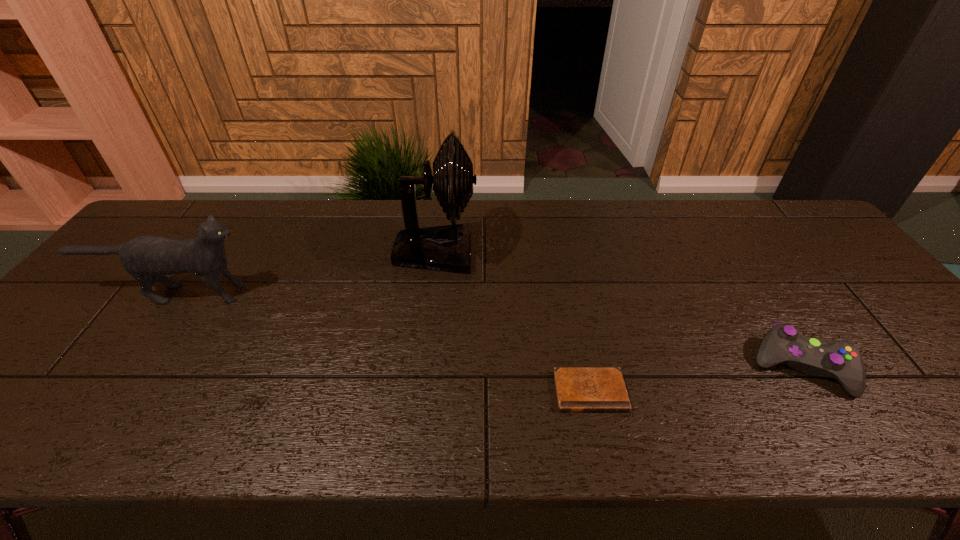
You are a GUI agent. You are given a task and a screenshot of the screen. Output one action in this format:
    pyautogui.click(x=<x>, y=<y>)
    Task: Click on the free space between the shortest object and the fan
    
    Given the screenshot: What is the action you would take?
    pyautogui.click(x=513, y=322)

You are a GUI agent. You are given a task and a screenshot of the screen. Output one action in this format:
    pyautogui.click(x=<x>, y=<y>)
    Task: Click on the unoccupied area between the rightmost object and the third shortest object
    The height and width of the screenshot is (540, 960).
    Given the screenshot: What is the action you would take?
    pyautogui.click(x=488, y=330)

Locate an element on the screen. Image resolution: width=960 pixels, height=540 pixels. free point between the rightmost object and the second farthest object is located at coordinates (488, 330).

In order to click on unoccupied area between the second shortest object and the diary in this screenshot , I will do pos(696,380).

The image size is (960, 540). Find the location of `free space between the farthest object and the second object from right to left`. free space between the farthest object and the second object from right to left is located at coordinates (513, 322).

The image size is (960, 540). In order to click on free space between the fan and the third nearest object in this screenshot , I will do `click(305, 273)`.

What are the coordinates of `unoccupied position between the leftmost object and the tallest object` in the screenshot? It's located at (305, 273).

Find the location of a particular element. This screenshot has width=960, height=540. empty space between the leftmost object and the third object from left to right is located at coordinates (383, 342).

Locate an element on the screen. The width and height of the screenshot is (960, 540). free point between the shortest object and the farthest object is located at coordinates (513, 322).

At what (x,y) coordinates should I click in order to perform the action: click on object that is the second closest one to the diary. Please return your answer as a coordinate pair (x, y). The width and height of the screenshot is (960, 540). Looking at the image, I should click on (446, 247).